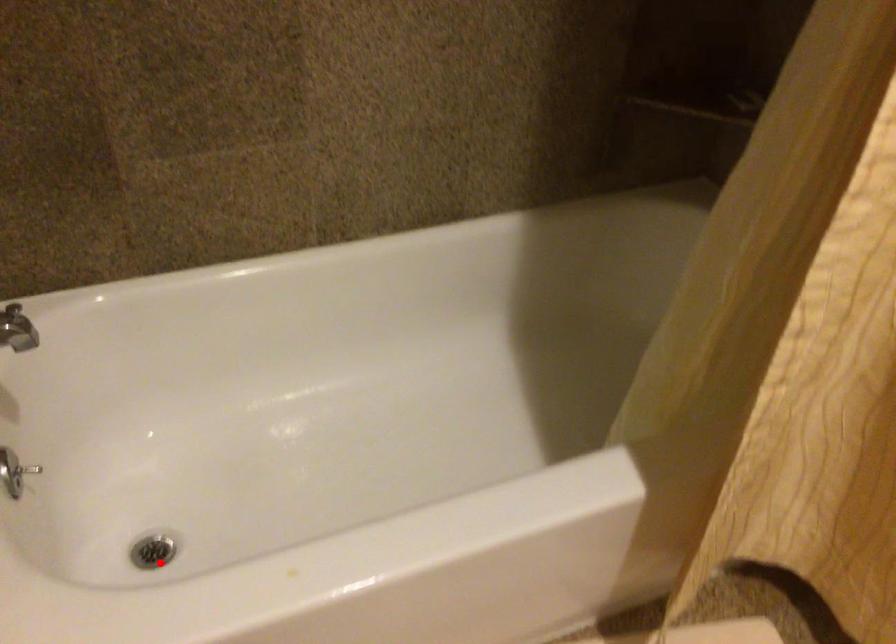
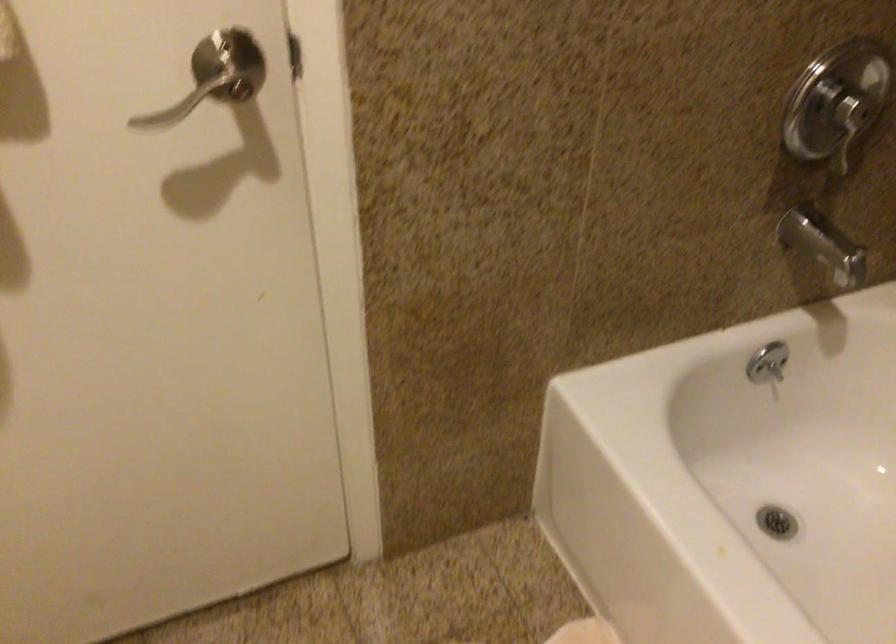
Locate, in the second image, the point that corresponds to the highlighted location in the first image.

(776, 522)